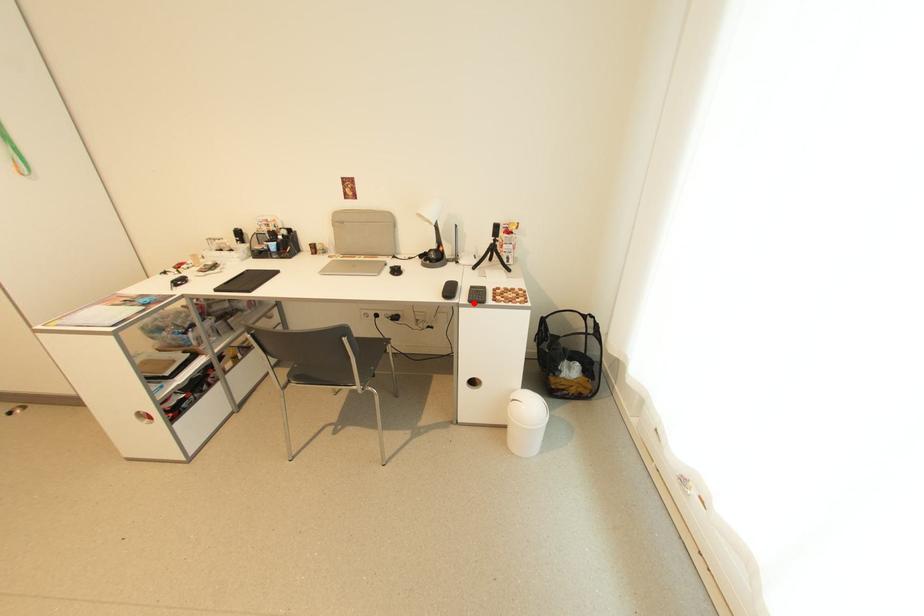
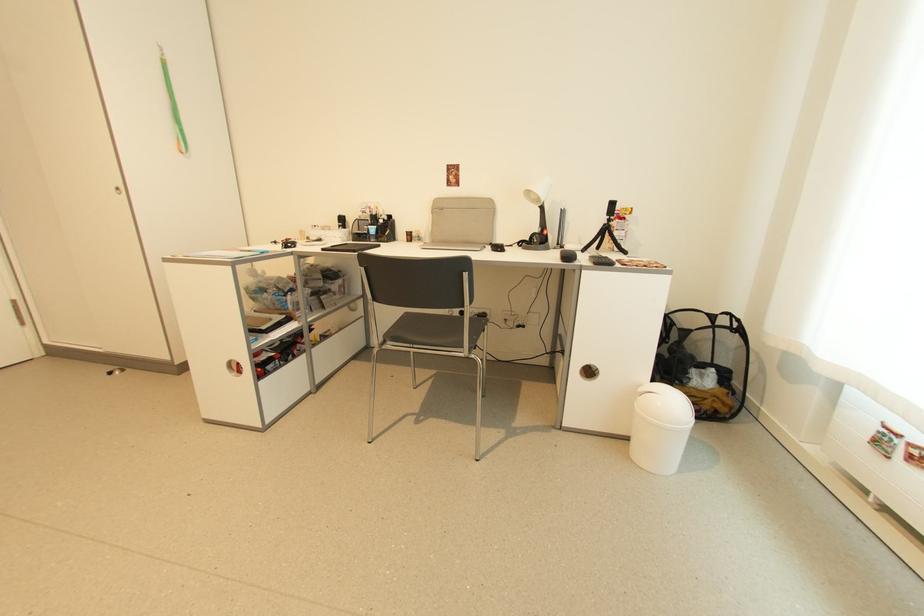
Find the pixel in the second image that matches the highlighted location in the first image.

(600, 265)